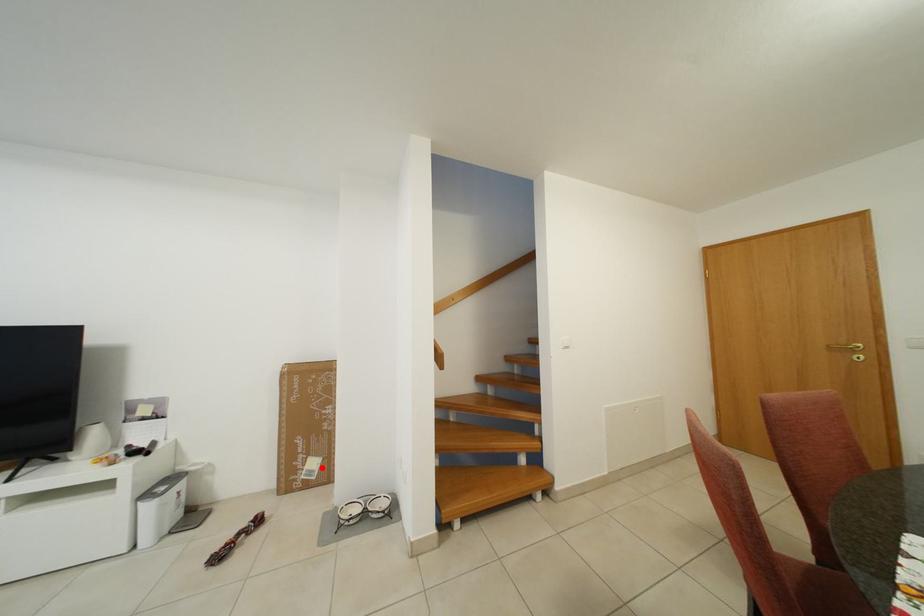
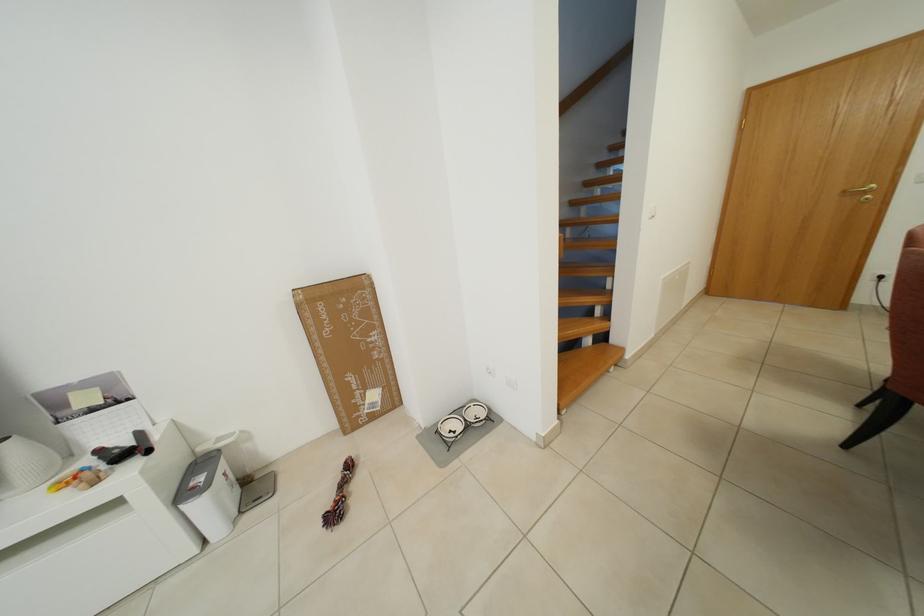
The point at the highlighted location is marked in the first image. Where is the corresponding point in the second image?

(382, 400)